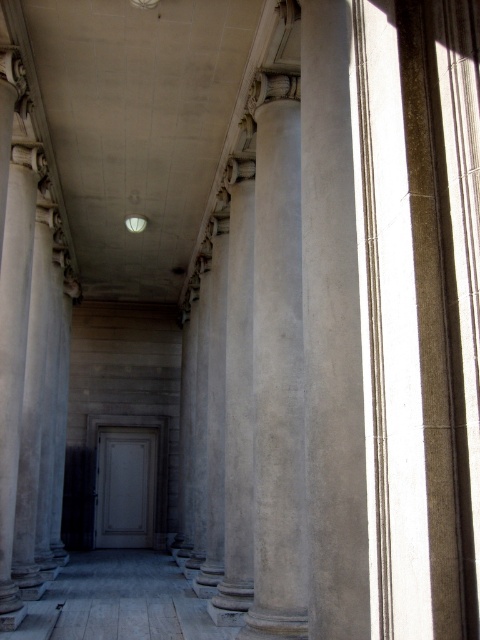
You are standing in front of the classical architectural structure shown in the image. You want to take a photo of the gray stone column at center from a distance that is exactly 30 feet away. Is it possible to move backward to achieve this distance?

The gray stone column at center is currently 27.67 feet away from the camera. To achieve a distance of 30 feet, you would need to move backward by approximately 2.33 feet. Since this is a feasible distance, yes, you can move backward to take the photo at exactly 30 feet.

From the picture: You are standing in a classical architectural structure and want to reach the white matte door at center. There is a smooth concrete column at center blocking your path. Can you walk around it to reach the door?

The smooth concrete column at center is in front of the white matte door at center, so you can walk around it to reach the door since it is blocking your path directly but not the entire area around.